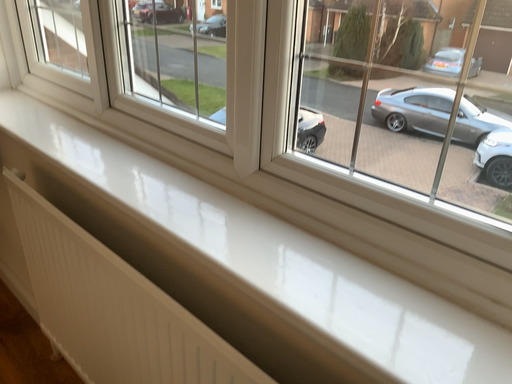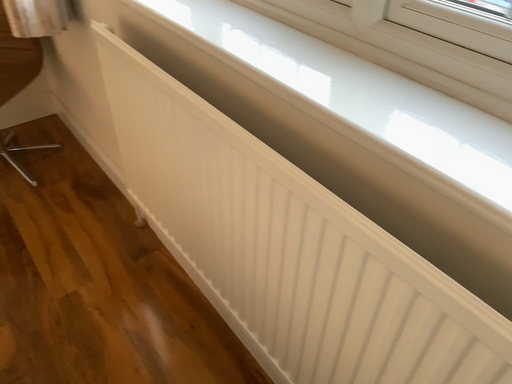
Question: Which way did the camera rotate in the video?

Choices:
 (A) rotated downward
 (B) rotated upward

Answer: (A)